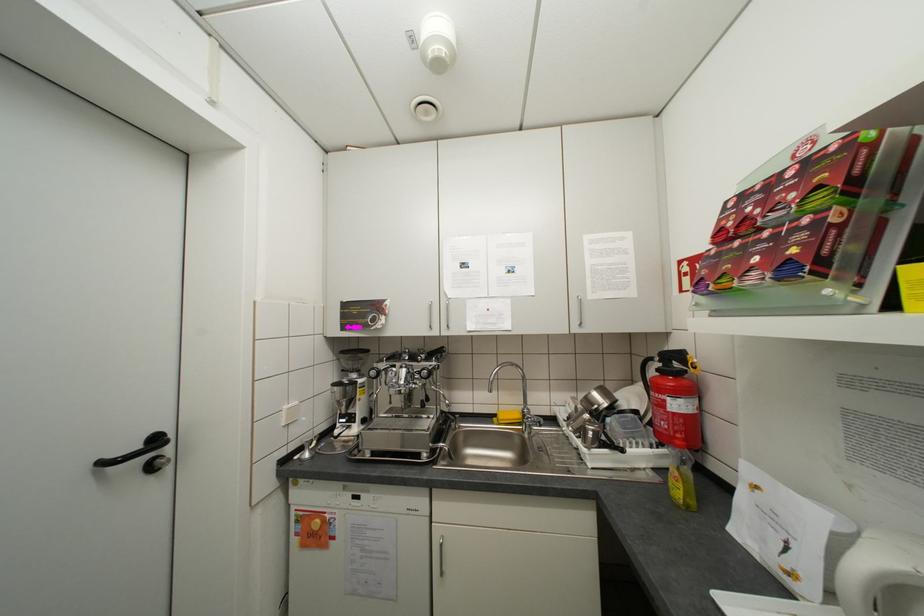
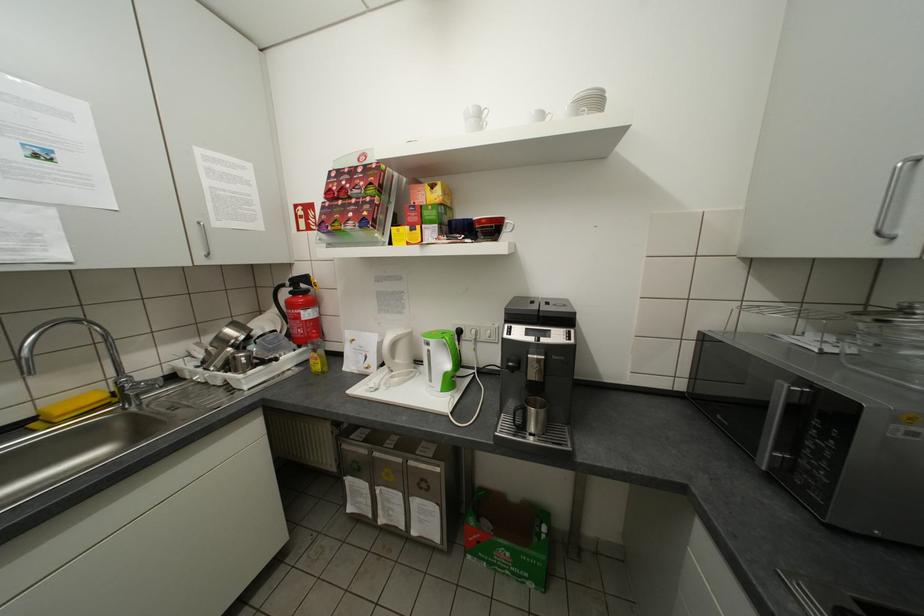
In the second image, find the point that corresponds to point (584, 323) in the first image.

(209, 253)